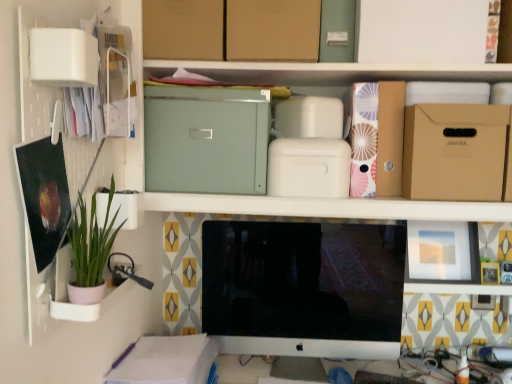
Question: Considering the relative sizes of white plastic cabinet at upper left and brown cardboard box at upper center, which is the 1th cardboard box from left to right, in the image provided, is white plastic cabinet at upper left taller than brown cardboard box at upper center, which is the 1th cardboard box from left to right,?

Choices:
 (A) no
 (B) yes

Answer: (B)

Question: From the image's perspective, is white plastic cabinet at upper left over brown cardboard box at upper center, which is the 1th cardboard box from left to right?

Choices:
 (A) yes
 (B) no

Answer: (B)

Question: Can you see white plastic cabinet at upper left touching brown cardboard box at upper center, which is the 1th cardboard box from left to right?

Choices:
 (A) no
 (B) yes

Answer: (A)

Question: Can you confirm if white plastic cabinet at upper left is positioned to the right of brown cardboard box at upper center, acting as the 5th cardboard box starting from the right?

Choices:
 (A) yes
 (B) no

Answer: (B)

Question: Is white plastic cabinet at upper left facing away from brown cardboard box at upper center, which is the 1th cardboard box from left to right?

Choices:
 (A) yes
 (B) no

Answer: (B)

Question: Does white plastic cabinet at upper left have a lesser width compared to brown cardboard box at upper center, which is the 1th cardboard box from left to right?

Choices:
 (A) yes
 (B) no

Answer: (A)

Question: Is brown cardboard box at upper center, acting as the 3th cardboard box starting from the right, taller than green matte plant at left?

Choices:
 (A) yes
 (B) no

Answer: (B)

Question: Is brown cardboard box at upper center, which is the third cardboard box from left to right, in contact with green matte plant at left?

Choices:
 (A) no
 (B) yes

Answer: (A)

Question: Does brown cardboard box at upper center, acting as the 3th cardboard box starting from the right, come behind green matte plant at left?

Choices:
 (A) yes
 (B) no

Answer: (A)

Question: Does brown cardboard box at upper center, which is the third cardboard box from left to right, have a lesser width compared to green matte plant at left?

Choices:
 (A) no
 (B) yes

Answer: (A)

Question: Can we say brown cardboard box at upper center, acting as the 3th cardboard box starting from the right, lies outside green matte plant at left?

Choices:
 (A) yes
 (B) no

Answer: (A)

Question: Considering the relative sizes of brown cardboard box at upper center, which is the third cardboard box from left to right, and green matte plant at left in the image provided, is brown cardboard box at upper center, which is the third cardboard box from left to right, smaller than green matte plant at left?

Choices:
 (A) yes
 (B) no

Answer: (B)

Question: From a real-world perspective, is brown cardboard box at upper right, acting as the fourth cardboard box starting from the left, positioned over matte green metal file cabinet at upper center based on gravity?

Choices:
 (A) no
 (B) yes

Answer: (A)